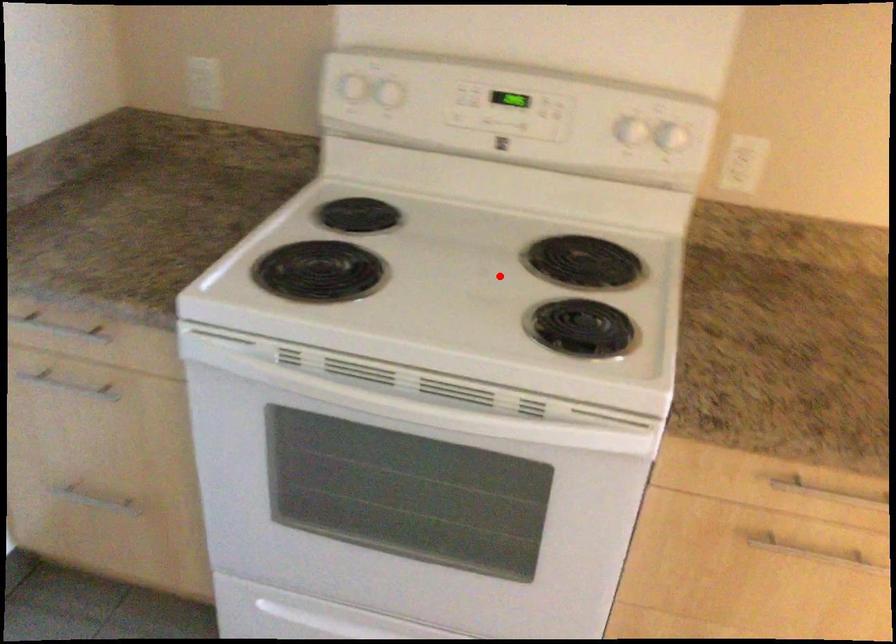
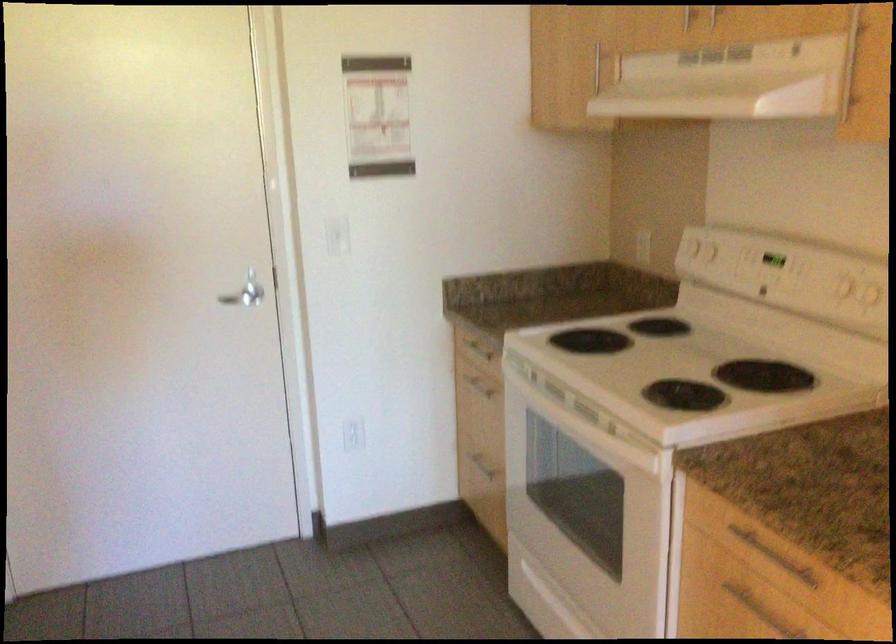
Question: I am providing you with two images of the same scene from different viewpoints. A red point is marked on the first image. Is the red point's position out of view in image 2?

Choices:
 (A) Yes
 (B) No

Answer: (B)